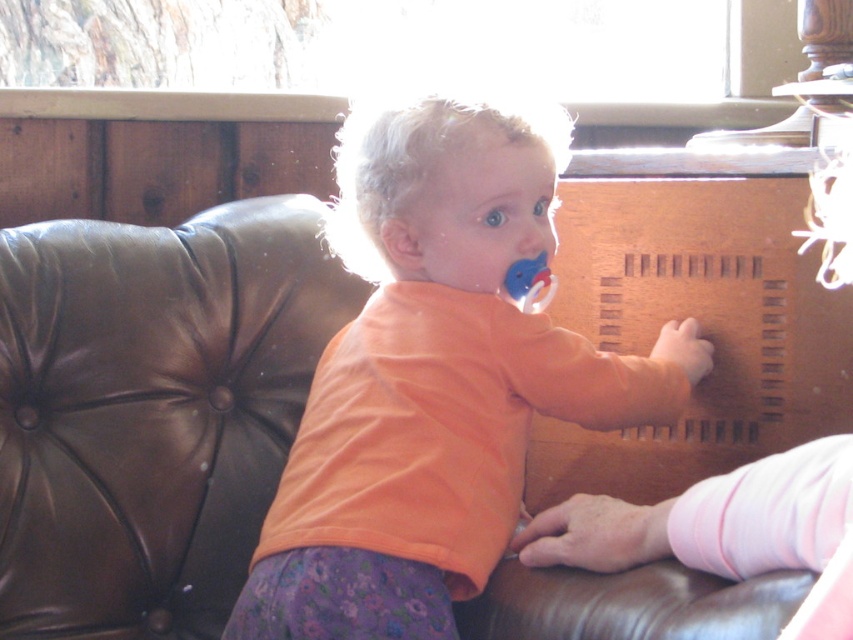
Between orange cotton shirt at center and blue rubber pacifier at upper center, which one is positioned higher?

blue rubber pacifier at upper center is higher up.

Between point (358, 499) and point (540, 298), which one is positioned behind?

Positioned behind is point (540, 298).

Image resolution: width=853 pixels, height=640 pixels. Describe the element at coordinates (434, 378) in the screenshot. I see `orange cotton shirt at center` at that location.

Identify the location of orange cotton shirt at center. (434, 378).